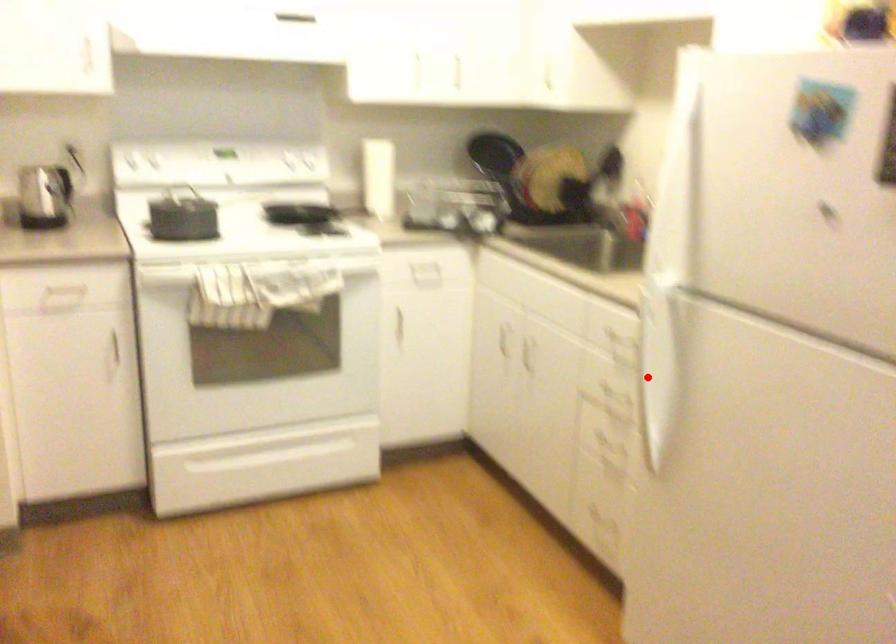
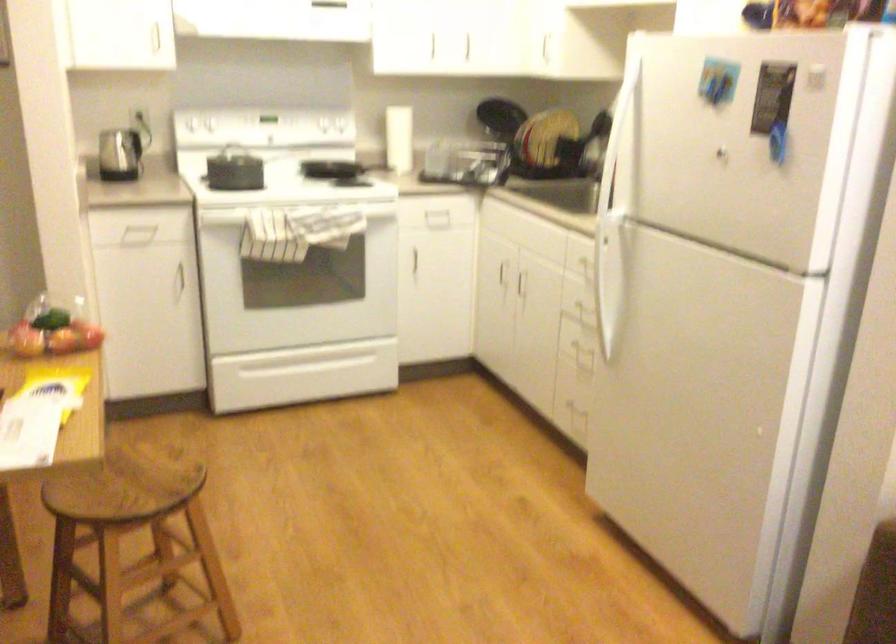
The point at the highlighted location is marked in the first image. Where is the corresponding point in the second image?

(607, 283)